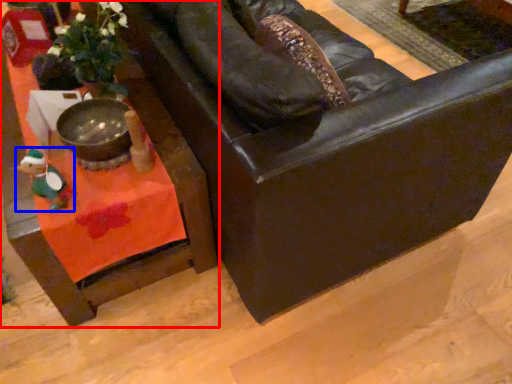
Question: Which point is closer to the camera, table (highlighted by a red box) or toy (highlighted by a blue box)?

Choices:
 (A) table
 (B) toy

Answer: (B)